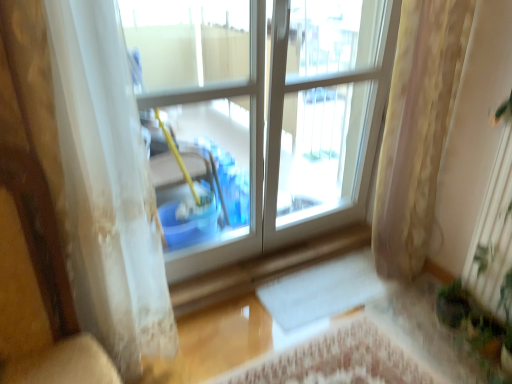
The image size is (512, 384). Identify the location of free space to the left of green leafy plant at lower right. (434, 355).